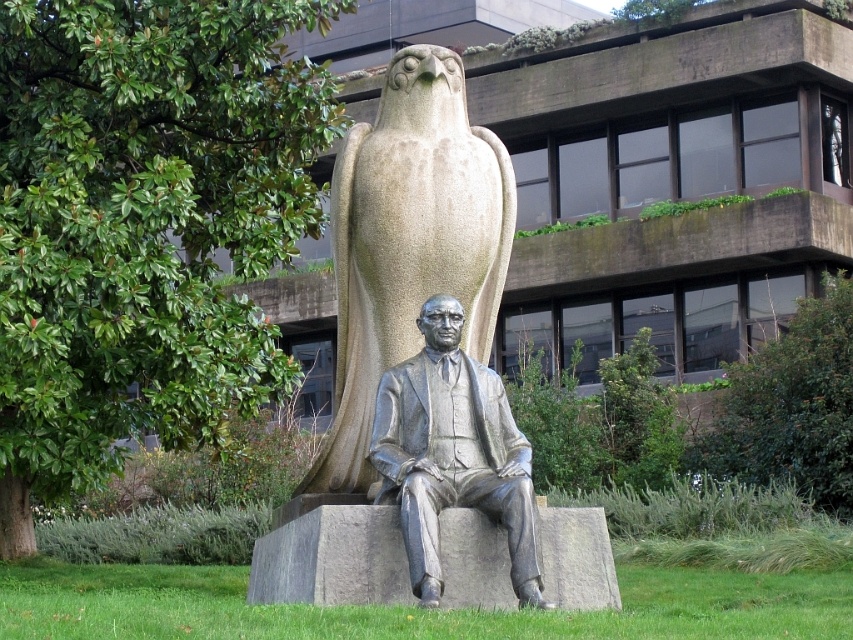
Does granite eagle at center have a lesser width compared to polished bronze statue at center?

In fact, granite eagle at center might be wider than polished bronze statue at center.

Does granite eagle at center have a greater height compared to polished bronze statue at center?

Indeed, granite eagle at center has a greater height compared to polished bronze statue at center.

The height and width of the screenshot is (640, 853). What are the coordinates of `granite eagle at center` in the screenshot? It's located at (408, 246).